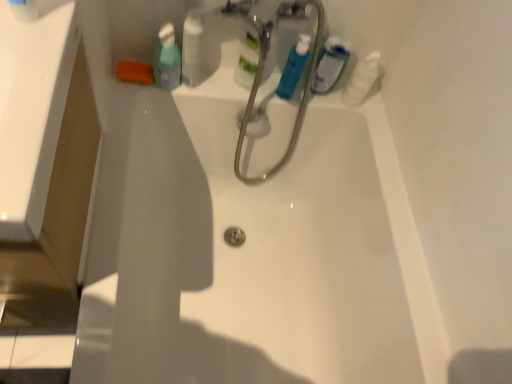
Question: From a real-world perspective, relative to blue glossy mouthwash at upper center, the 2th mouthwash when ordered from left to right, is translucent plastic mouthwash at upper center, acting as the 1th mouthwash starting from the left, vertically above or below?

Choices:
 (A) above
 (B) below

Answer: (B)

Question: Is translucent plastic mouthwash at upper center, acting as the 1th mouthwash starting from the left, in front of or behind blue glossy mouthwash at upper center, which appears as the second mouthwash when viewed from the right, in the image?

Choices:
 (A) front
 (B) behind

Answer: (A)

Question: Which is farther from the translucent plastic mouthwash at upper center, placed as the third mouthwash when sorted from right to left?

Choices:
 (A) translucent plastic mouthwash at upper right, which appears as the 1th mouthwash when viewed from the right
 (B) blue glossy mouthwash at upper center, which appears as the second mouthwash when viewed from the right
 (C) white glossy bottle at upper right
 (D) white glossy bottle at upper center

Answer: (C)

Question: Which object is the closest to the white glossy bottle at upper right?

Choices:
 (A) blue glossy mouthwash at upper center, the 2th mouthwash when ordered from left to right
 (B) translucent plastic mouthwash at upper right, which appears as the 1th mouthwash when viewed from the right
 (C) white glossy bottle at upper center
 (D) translucent plastic mouthwash at upper center, placed as the third mouthwash when sorted from right to left

Answer: (B)